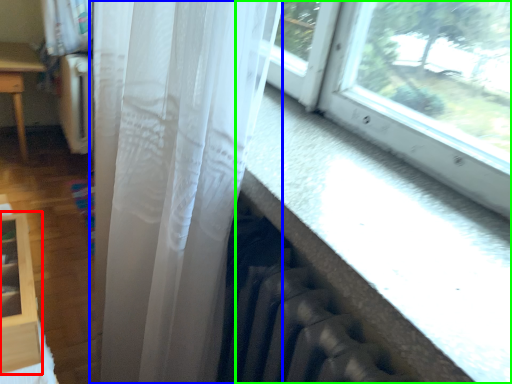
Question: Considering the real-world distances, which object is farthest from shelf (highlighted by a red box)? curtain (highlighted by a blue box) or window (highlighted by a green box)?

Choices:
 (A) curtain
 (B) window

Answer: (B)